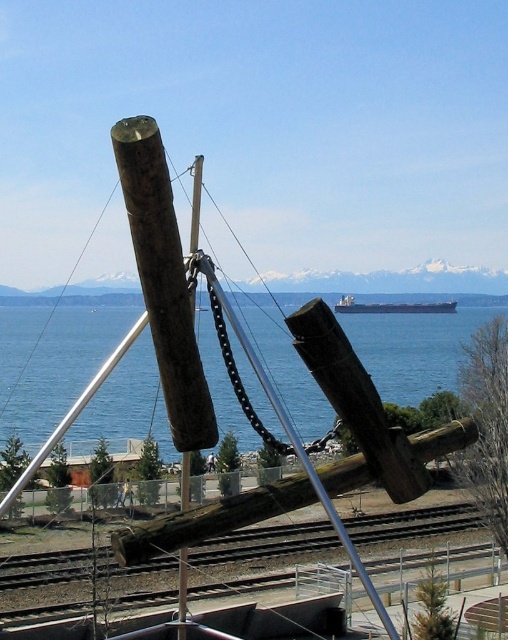
You are standing on a dock and see the blue water at center and the wooden log at center. Which object is higher from the ground?

The blue water at center is above the wooden log at center, so the blue water at center is higher from the ground.

You are standing at the waterfront and see the wooden log at center and the metallic gray ship at center. If you want to throw a stone to hit both objects with one throw, which one should you aim for first, the closer one or the farther one?

The wooden log at center is 96.38 meters away from the metallic gray ship at center. Since you can only aim for one, you should aim for the closer one first to increase your chances of hitting it before the stone falls.

You are standing in front of the industrial structure and want to know which of the two points, point (x=16, y=365) or point (x=453, y=307), is nearer to you. Can you determine this based on their positions?

Point (x=16, y=365) is closer to the camera than point (x=453, y=307), so it is nearer to you.